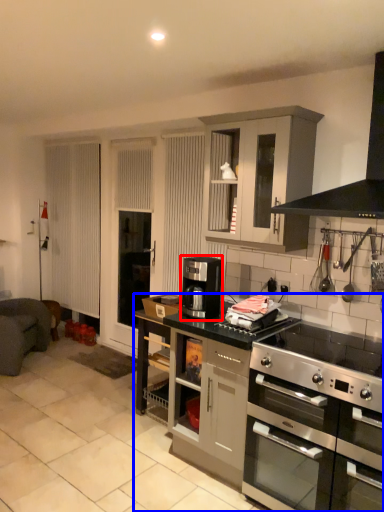
Question: Among these objects, which one is farthest to the camera, coffee machine (highlighted by a red box) or counter (highlighted by a blue box)?

Choices:
 (A) coffee machine
 (B) counter

Answer: (A)